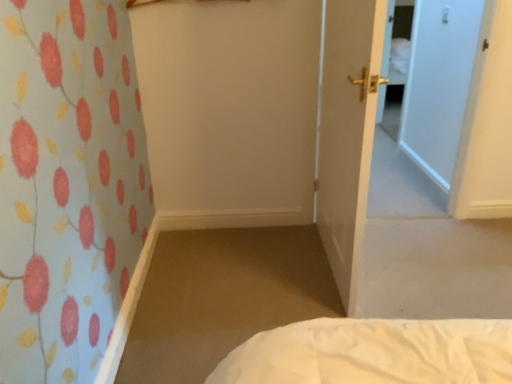
Where is `free spot in front of gold metallic door handle at center`? The image size is (512, 384). free spot in front of gold metallic door handle at center is located at coordinates (329, 299).